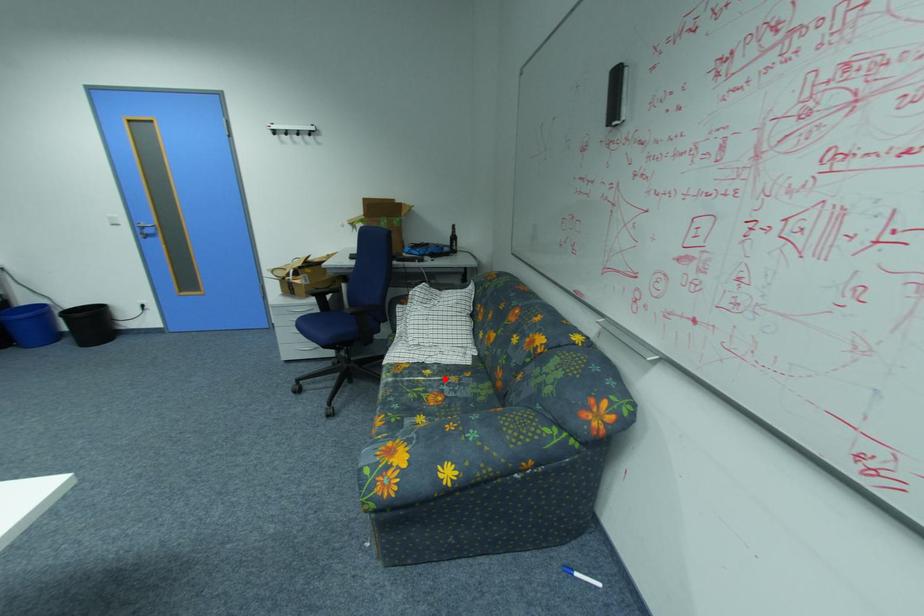
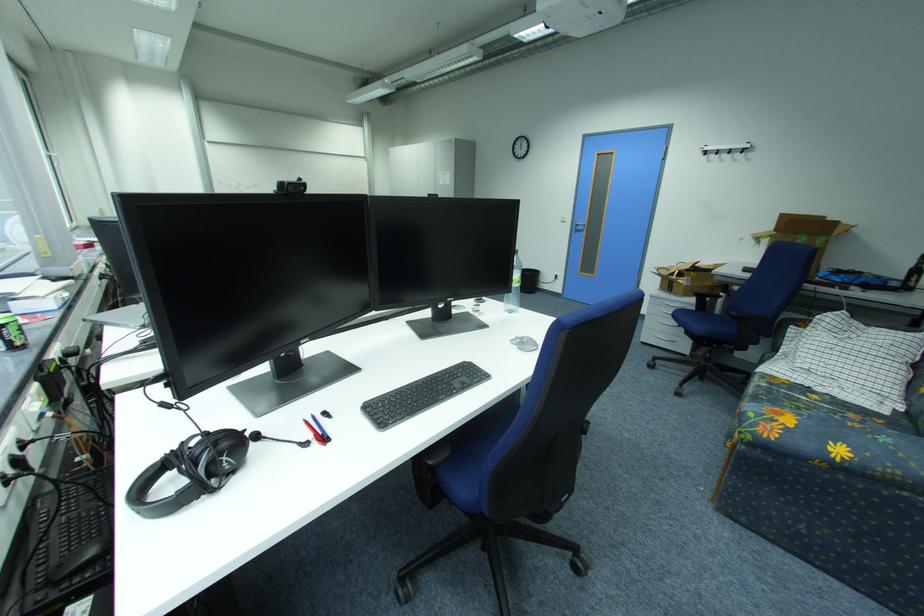
Question: A red point is marked in image1. In image2, is the corresponding 3D point closer to the camera or farther? Reply with the corresponding letter.

Choices:
 (A) The corresponding 3D point is closer.
 (B) The corresponding 3D point is farther.

Answer: (B)